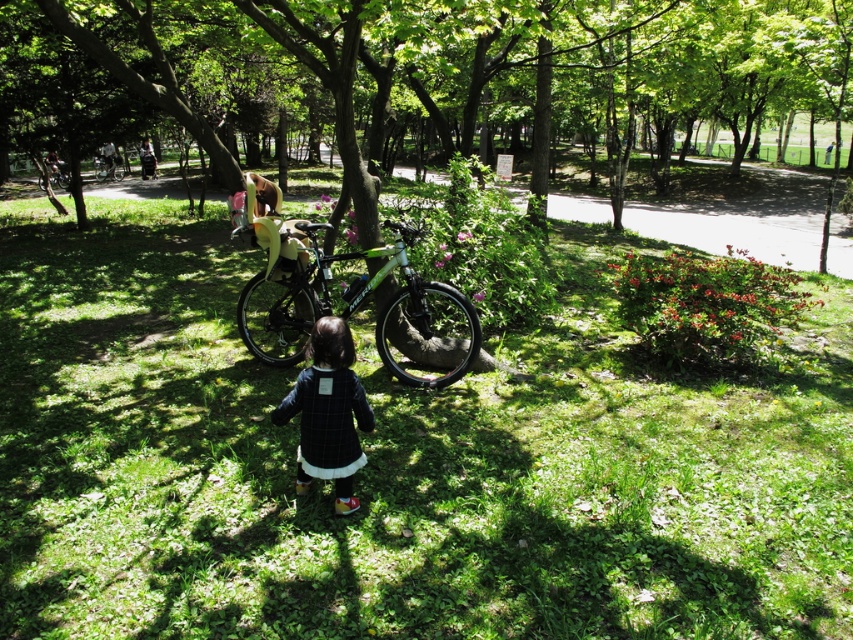
You are a parent trying to decide whether to let your child play near the green matte tree at center and the green matte bicycle at upper left. Considering their sizes, which one is safer for the child to be near? Please explain your reasoning based on their sizes.

The green matte tree at center is much taller than the green matte bicycle at upper left. While the tree is taller, it might pose a risk if branches are low or unstable, but the bicycle being smaller is less likely to cause harm in terms of size. However, safety also depends on other factors like the tree trunk being sturdy and the bicycle being securely parked.

You are a parent trying to decide where to place a picnic blanket in the park. You see the green grass at center and the green matte tree at center. Which area would you choose if you want a spot that is less likely to be overshadowed by the tree?

The green grass at center has a smaller size compared to green matte tree at center, so it might be a better choice for a picnic spot less likely to be overshadowed by the tree.

You are a photographer planning to take a photo of the dark blue wool dress at center in the park scene. The park has a rule that photos must include at least one natural element from the environment. Which natural element from the scene can you include in the photo to comply with the park rules?

The dark blue wool dress at center is positioned near a tree trunk and surrounded by grass dotted with small green plants and fallen leaves. Including the tree trunk or the grass with green plants and leaves would satisfy the park rule.